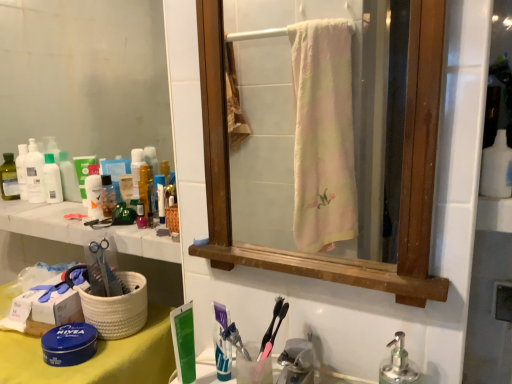
At what (x,y) coordinates should I click in order to perform the action: click on free space in front of translucent plastic mouthwash at left, the second mouthwash from the right. Please return your answer as a coordinate pair (x, y). Looking at the image, I should click on (32, 209).